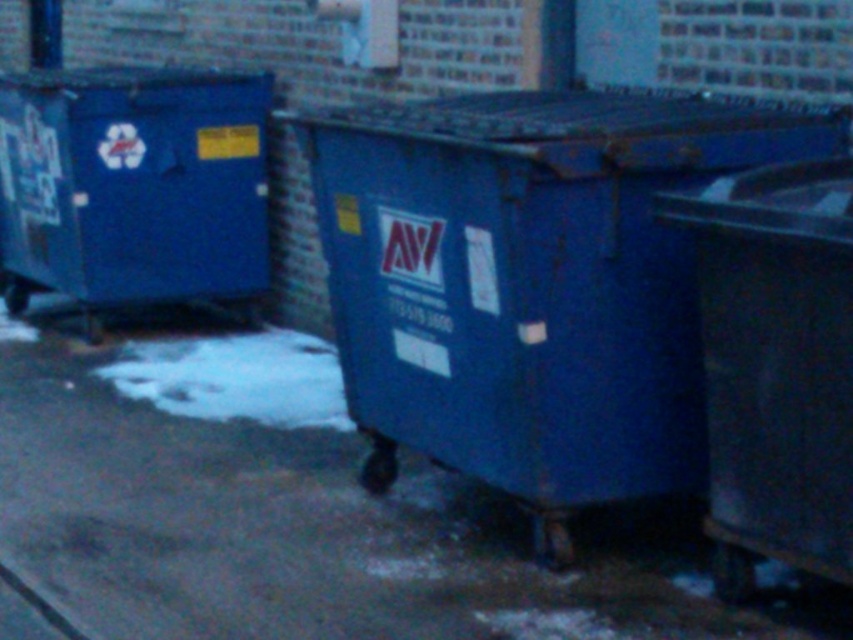
Question: From the image, what is the correct spatial relationship of slick asphalt pavement at center in relation to rusty metal dumpster at right?

Choices:
 (A) right
 (B) left

Answer: (B)

Question: Estimate the real-world distances between objects in this image. Which object is closer to the slick asphalt pavement at center?

Choices:
 (A) matte blue recycling bin at left
 (B) rusty metal dumpster at right
 (C) blue matte dumpster at center

Answer: (C)

Question: Can you confirm if slick asphalt pavement at center is positioned to the right of blue matte dumpster at center?

Choices:
 (A) yes
 (B) no

Answer: (B)

Question: Which of the following is the closest to the observer?

Choices:
 (A) (267, 109)
 (B) (27, 481)
 (C) (421, 280)

Answer: (C)

Question: Which point is closer to the camera taking this photo?

Choices:
 (A) (138, 602)
 (B) (722, 428)
 (C) (175, 161)

Answer: (B)

Question: Is slick asphalt pavement at center to the right of matte blue recycling bin at left from the viewer's perspective?

Choices:
 (A) yes
 (B) no

Answer: (A)